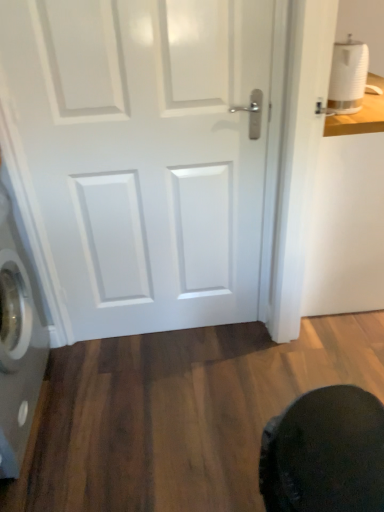
Where is `free space in front of white glossy door at center`? This screenshot has height=512, width=384. free space in front of white glossy door at center is located at coordinates (168, 405).